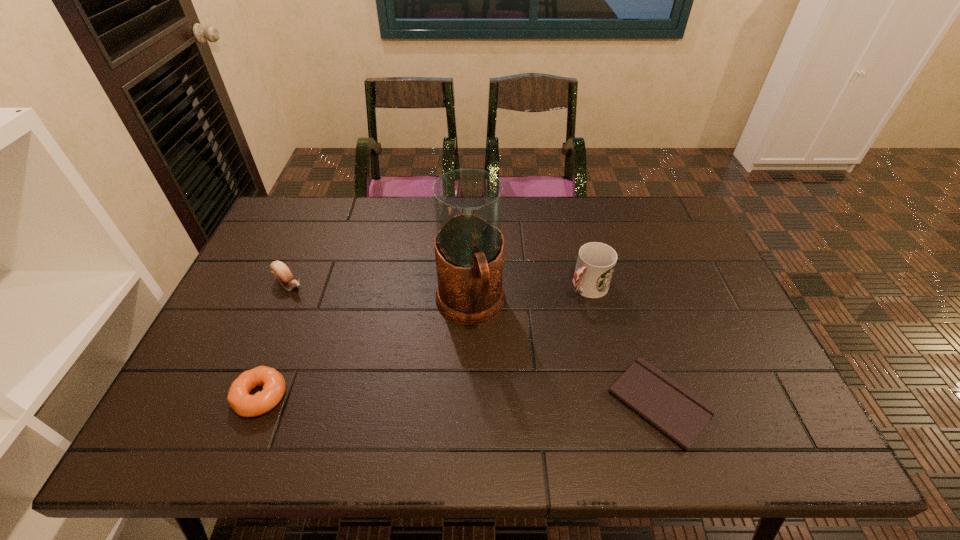
You are a GUI agent. You are given a task and a screenshot of the screen. Output one action in this format:
    pyautogui.click(x=<x>, y=<y>)
    Task: Click on the second shortest object
    The width and height of the screenshot is (960, 540).
    Given the screenshot: What is the action you would take?
    pyautogui.click(x=274, y=386)

At what (x,y) coordinates should I click in order to perform the action: click on checkbook. Please return your answer as a coordinate pair (x, y). Looking at the image, I should click on (678, 413).

Identify the location of the second tallest object. (596, 261).

Identify the location of escargot. The height and width of the screenshot is (540, 960). (280, 271).

Locate an element on the screen. The image size is (960, 540). pitcher is located at coordinates (468, 203).

You are a GUI agent. You are given a task and a screenshot of the screen. Output one action in this format:
    pyautogui.click(x=<x>, y=<y>)
    Task: Click on the third object from left to right
    The image size is (960, 540).
    Given the screenshot: What is the action you would take?
    pyautogui.click(x=468, y=203)

This screenshot has height=540, width=960. What are the coordinates of `free space located 0.060m on the left of the doughnut` in the screenshot? It's located at (208, 396).

This screenshot has height=540, width=960. Identify the location of free location located 0.070m on the back of the shortest object. (639, 339).

Identify the location of vacant region located 0.100m on the side of the cup where the handle is located. (551, 317).

Identify the location of vacant space situated 0.400m on the side of the cup where the handle is located. (468, 384).